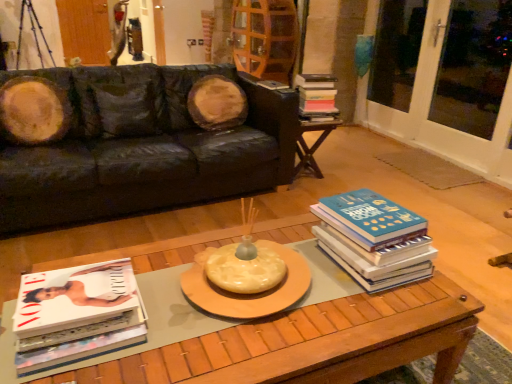
The image size is (512, 384). What are the coordinates of `vacant area to the right of white glossy magazine at lower left, which ranks as the 1th book in left-to-right order` in the screenshot? It's located at (176, 332).